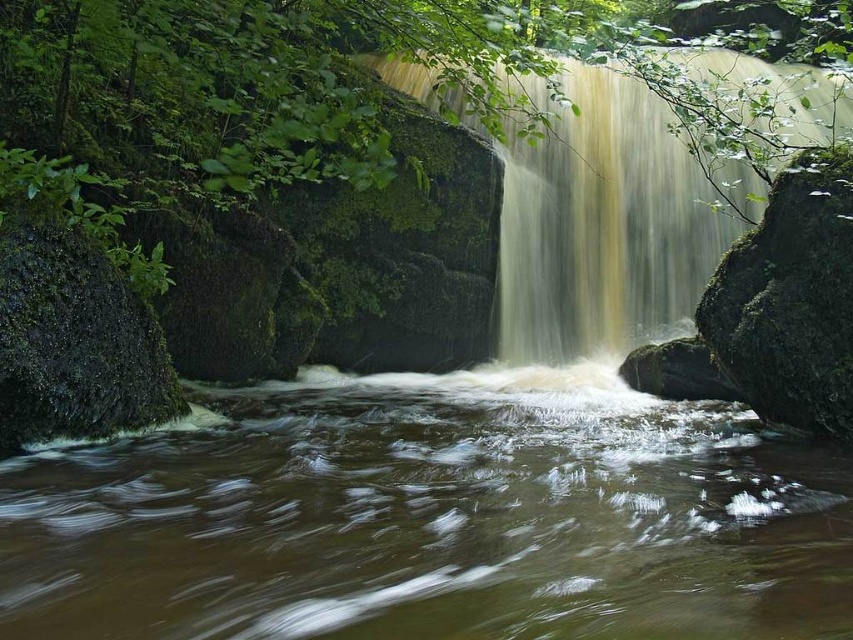
The height and width of the screenshot is (640, 853). What do you see at coordinates (602, 227) in the screenshot? I see `yellowish-green mossy rock at center` at bounding box center [602, 227].

Between yellowish-green mossy rock at center and green mossy rock at left, which one appears on the right side from the viewer's perspective?

yellowish-green mossy rock at center is more to the right.

Is point (581, 355) closer to camera compared to point (22, 228)?

No, (581, 355) is behind (22, 228).

Locate an element on the screen. This screenshot has width=853, height=640. yellowish-green mossy rock at center is located at coordinates (602, 227).

Can you confirm if yellowish-green mossy rock at center is positioned to the left of green mossy rock at right?

Incorrect, yellowish-green mossy rock at center is not on the left side of green mossy rock at right.

Which of these two, yellowish-green mossy rock at center or green mossy rock at right, stands shorter?

yellowish-green mossy rock at center

Where is `yellowish-green mossy rock at center`? Image resolution: width=853 pixels, height=640 pixels. yellowish-green mossy rock at center is located at coordinates (602, 227).

The image size is (853, 640). I want to click on yellowish-green mossy rock at center, so (602, 227).

In the scene shown: Does brown/muddy water at center appear under green mossy rock at right?

Indeed, brown/muddy water at center is positioned under green mossy rock at right.

Image resolution: width=853 pixels, height=640 pixels. Identify the location of brown/muddy water at center. (433, 518).